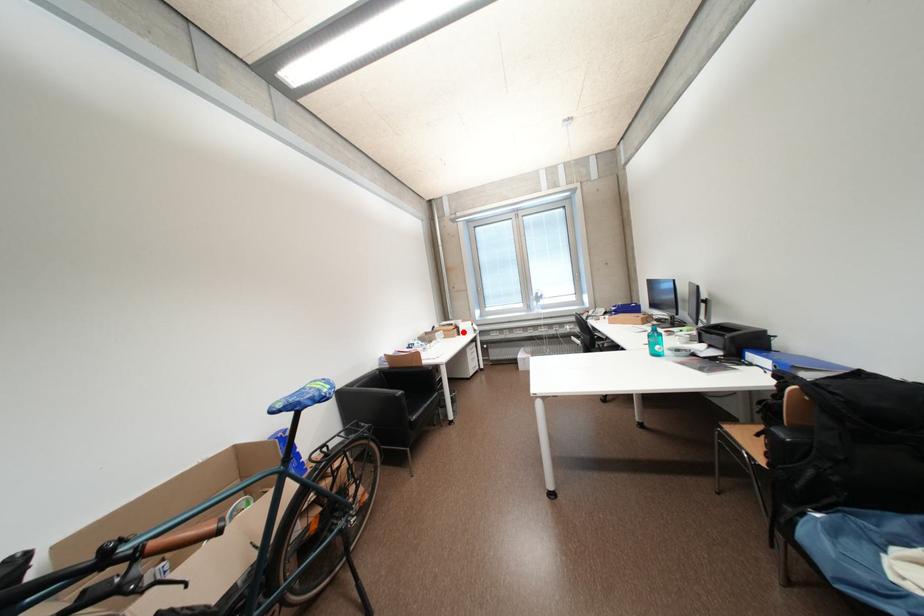
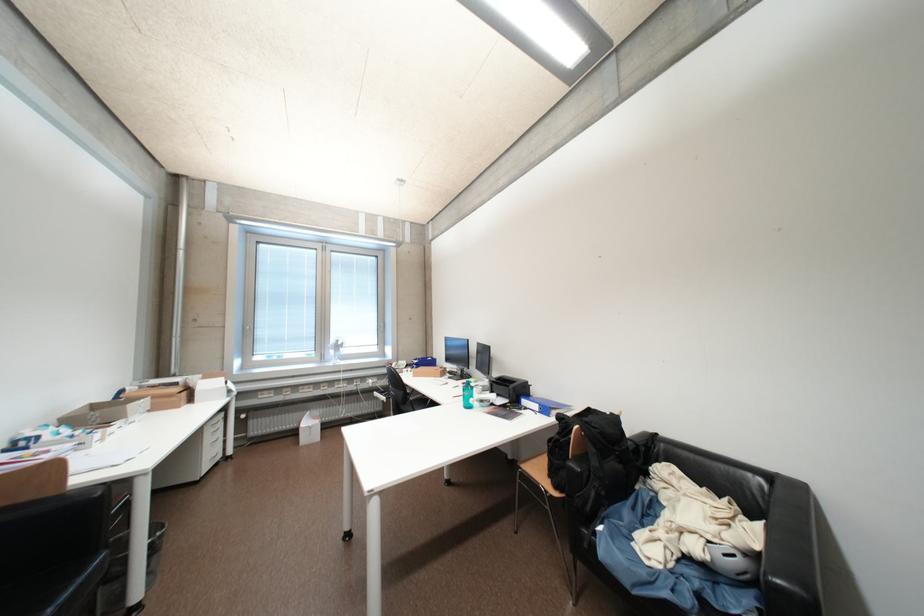
Where in the second image is the point corresponding to the highlighted location from the first image?

(192, 395)